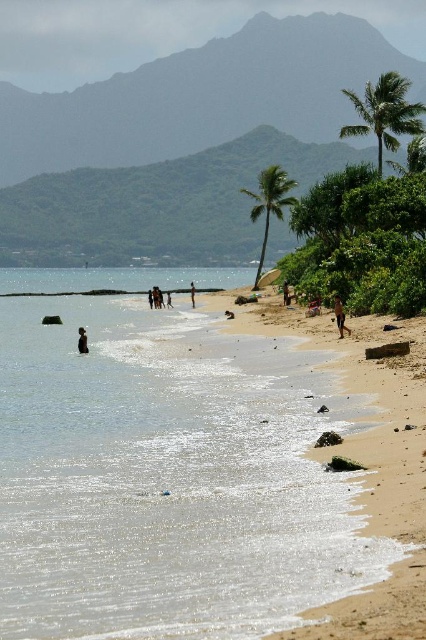
Question: Which of the following is the closest to the observer?

Choices:
 (A) (253, 192)
 (B) (235, 524)

Answer: (B)

Question: Does green leafy palm tree at center have a smaller size compared to dark brown skin at lower left?

Choices:
 (A) no
 (B) yes

Answer: (A)

Question: Which is farther from the dark brown skin at lower left?

Choices:
 (A) green leafy palm tree at upper right
 (B) light brown sandy beach at center
 (C) brown sand at lower center

Answer: (A)

Question: Which object is positioned closest to the green leafy palm tree at upper right?

Choices:
 (A) green leafy palm tree at center
 (B) light brown sandy beach at center
 (C) dark brown skin at lower left
 (D) smooth skin person at center

Answer: (A)

Question: Does clear water at beach left have a greater width compared to brown sand at lower center?

Choices:
 (A) yes
 (B) no

Answer: (A)

Question: Does clear water at beach left appear over brown sand at lower center?

Choices:
 (A) no
 (B) yes

Answer: (A)